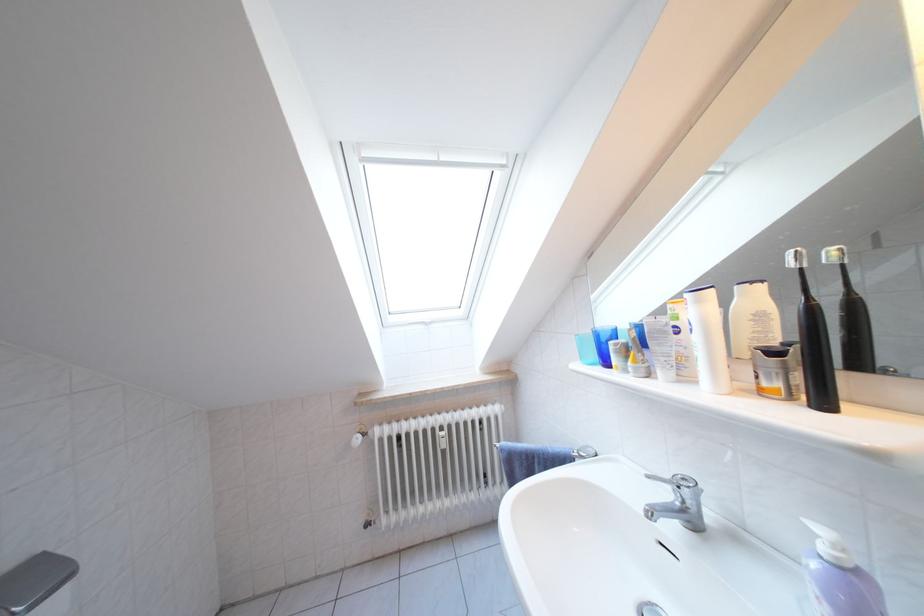
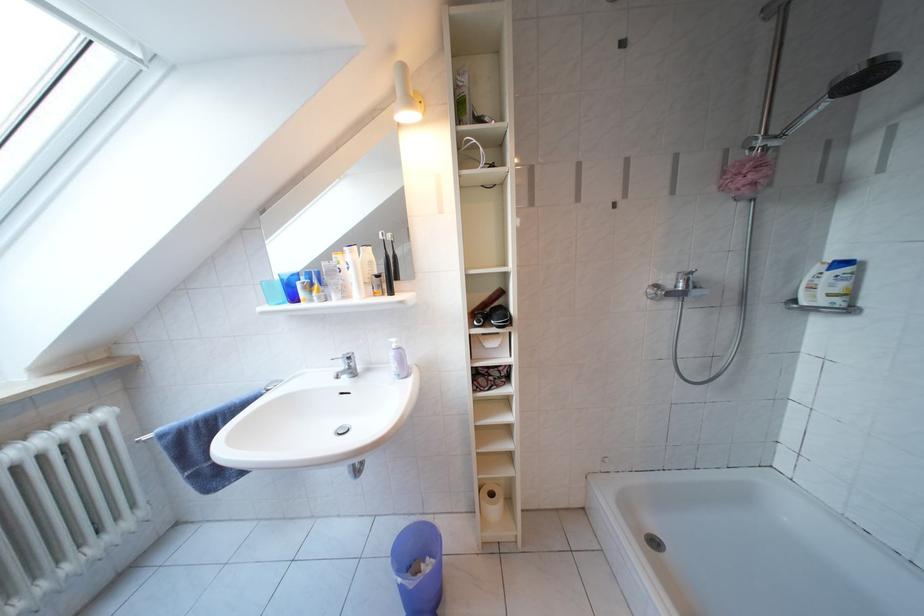
Where in the second image is the point corresponding to the point at 675,500 from the first image?

(349, 371)